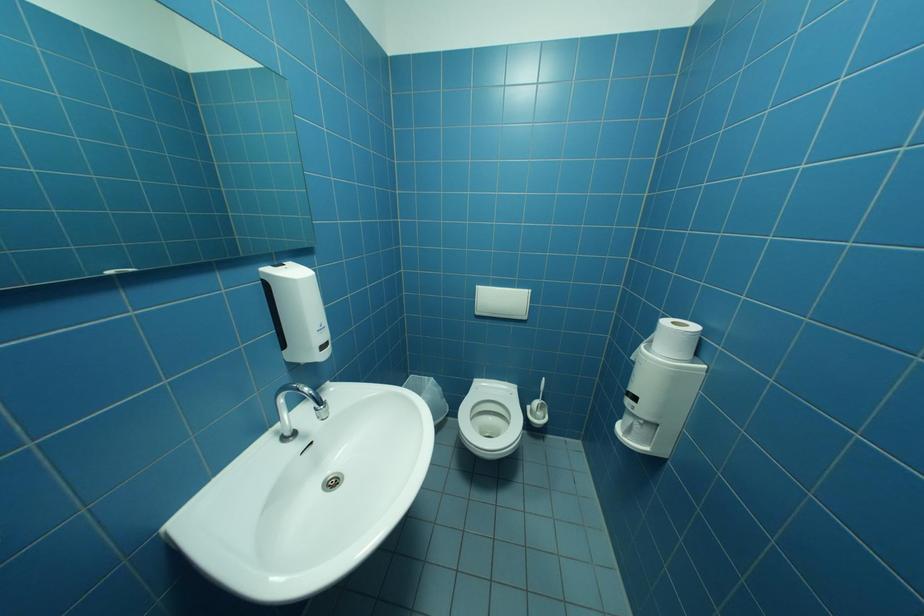
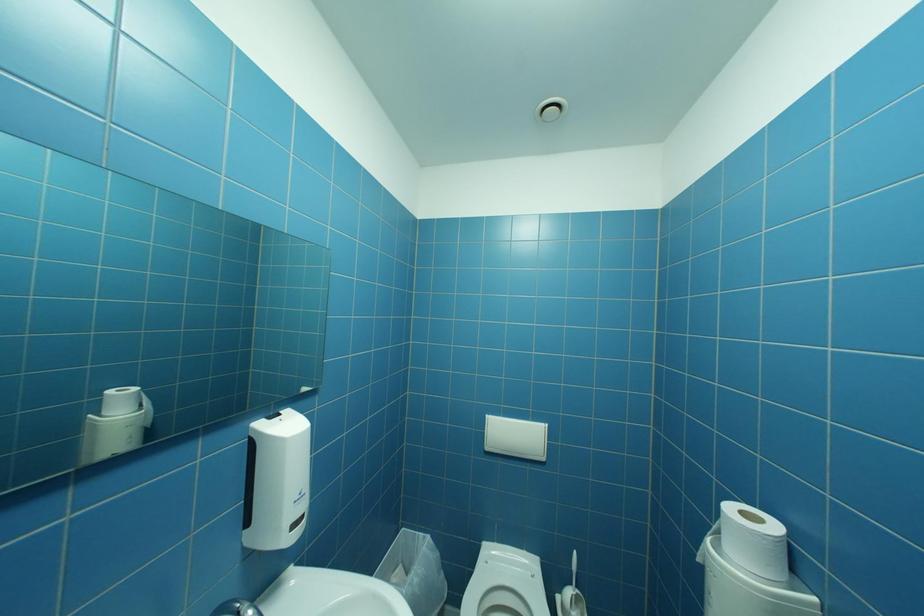
Looking at this image, in a continuous first-person perspective shot, in which direction is the camera moving?

The movement direction of the cameraman is left, forward.